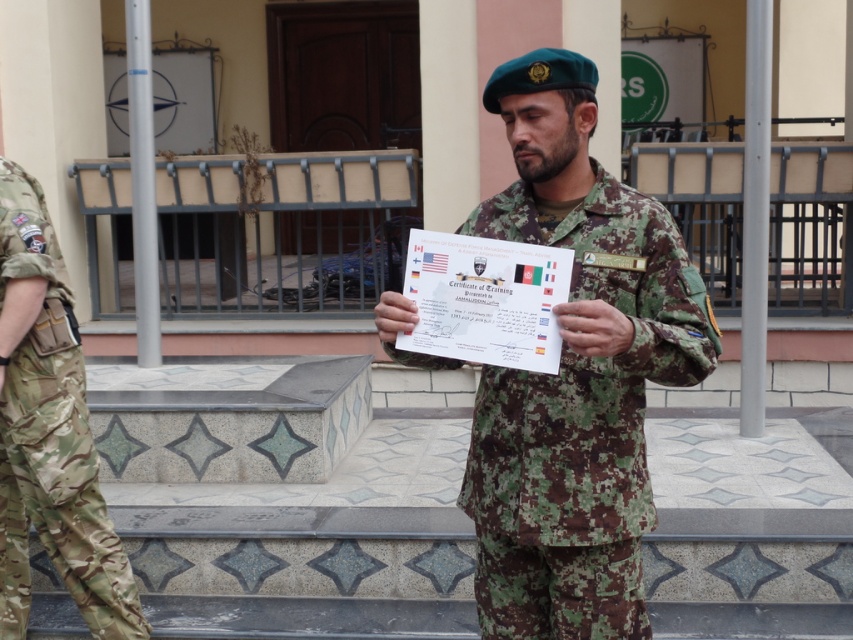
You are a tailor who needs to determine which item requires more fabric to make between the camouflage uniform at center and the camouflage fabric pants at left. Based on the description, which one would need more fabric?

The camouflage uniform at center requires more fabric because its width is larger than the camouflage fabric pants at left.

You are a military observer assessing the positioning of personnel in the image. Which individual is closer to you, the camouflage uniform at center or the camouflage fabric pants at left?

The camouflage uniform at center is closer to you since it is positioned in front of the camouflage fabric pants at left.